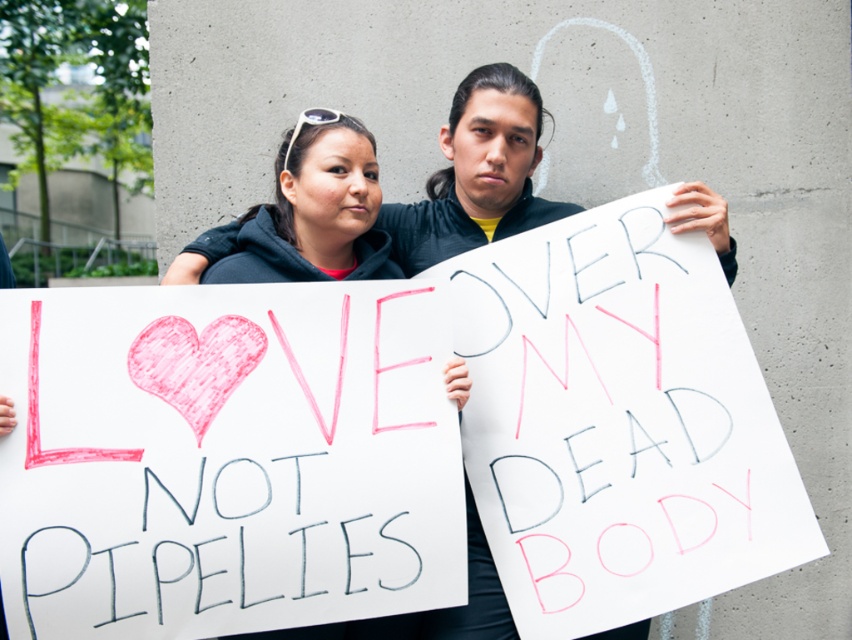
Does matte black jacket at center lie in front of matte black hoodie at center?

No, it is not.

Can you confirm if matte black jacket at center is wider than matte black hoodie at center?

Yes, matte black jacket at center is wider than matte black hoodie at center.

Is point (511, 636) behind point (366, 172)?

No.

Where is `matte black jacket at center`? The image size is (852, 640). matte black jacket at center is located at coordinates (476, 173).